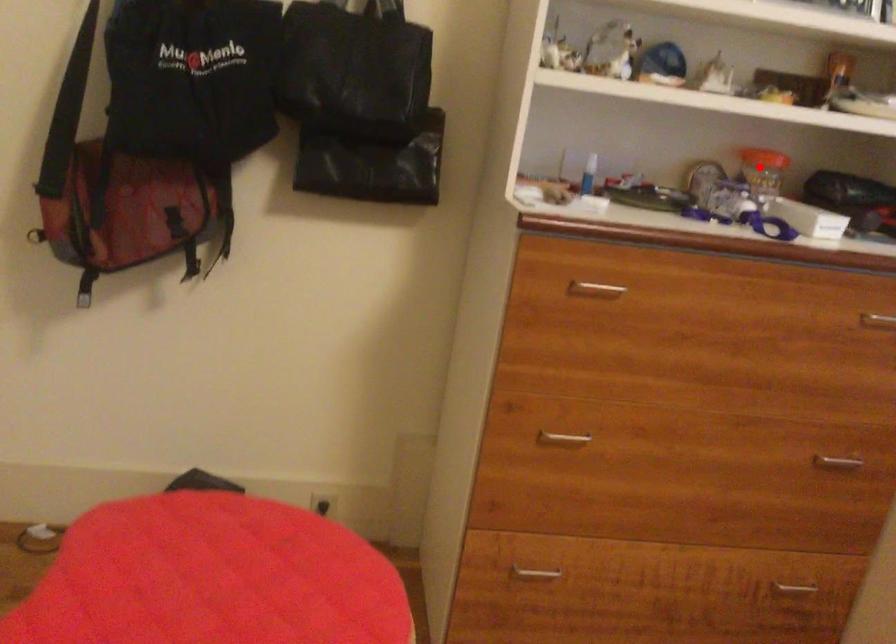
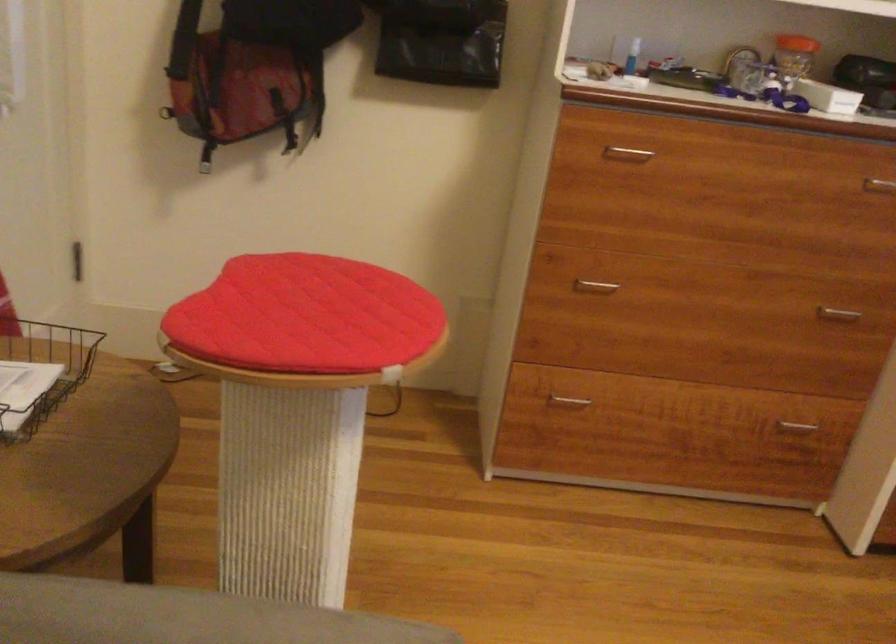
Question: I am providing you with two images of the same scene from different viewpoints. A red point is marked on the first image. Is the red point's position out of view in image 2?

Choices:
 (A) Yes
 (B) No

Answer: (B)